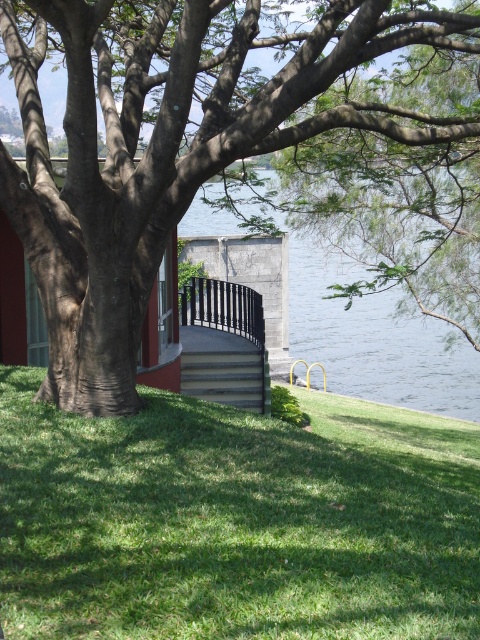
Question: Which object is positioned closest to the green grass at lower center?

Choices:
 (A) gray concrete stairs at lower center
 (B) black metal railing at center
 (C) brown rough tree at center

Answer: (A)

Question: Is green grass at lower center positioned before brown rough tree at center?

Choices:
 (A) no
 (B) yes

Answer: (B)

Question: Which object is closer to the camera taking this photo?

Choices:
 (A) gray concrete stairs at lower center
 (B) green grass at lower center
 (C) brown rough tree at center
 (D) black metal railing at center

Answer: (B)

Question: Does green grass at lower center appear on the right side of brown rough tree at center?

Choices:
 (A) no
 (B) yes

Answer: (B)

Question: Which of these objects is positioned closest to the gray concrete stairs at lower center?

Choices:
 (A) brown rough tree at center
 (B) black metal railing at center
 (C) green grass at lower center

Answer: (C)

Question: Can you confirm if gray concrete stairs at lower center is bigger than black metal railing at center?

Choices:
 (A) no
 (B) yes

Answer: (B)